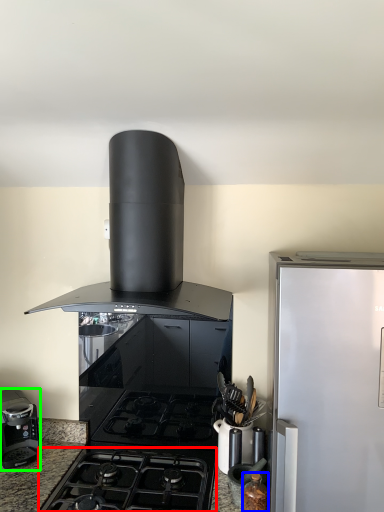
Question: Estimate the real-world distances between objects in this image. Which object is closer to gas stove (highlighted by a red box), kitchen appliance (highlighted by a blue box) or kitchen appliance (highlighted by a green box)?

Choices:
 (A) kitchen appliance
 (B) kitchen appliance

Answer: (B)